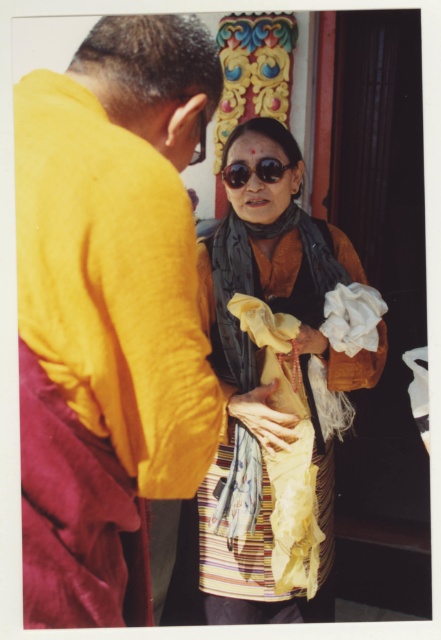
Question: Can you confirm if yellow cotton robe at center is bigger than matte black sunglasses at center?

Choices:
 (A) yes
 (B) no

Answer: (A)

Question: Which is farther from the textured yellow fabric at center?

Choices:
 (A) yellow cotton robe at center
 (B) matte black sunglasses at center

Answer: (A)

Question: Considering the relative positions of textured yellow fabric at center and matte black sunglasses at center in the image provided, where is textured yellow fabric at center located with respect to matte black sunglasses at center?

Choices:
 (A) above
 (B) below

Answer: (B)

Question: Which point is farther from the camera taking this photo?

Choices:
 (A) (115, 122)
 (B) (261, 381)
 (C) (232, 180)

Answer: (C)

Question: Does yellow cotton robe at center come in front of textured yellow fabric at center?

Choices:
 (A) no
 (B) yes

Answer: (B)

Question: Which of these objects is positioned farthest from the matte black sunglasses at center?

Choices:
 (A) yellow cotton robe at center
 (B) textured yellow fabric at center

Answer: (A)